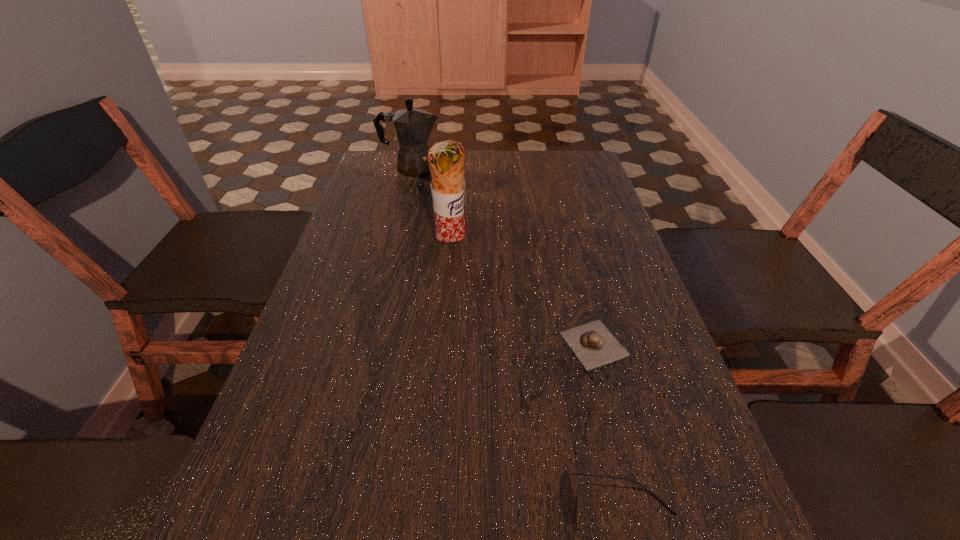
In order to click on burrito in this screenshot , I will do coord(446,159).

At what (x,y) coordinates should I click in order to perform the action: click on the tallest object. Please return your answer as a coordinate pair (x, y). This screenshot has height=540, width=960. Looking at the image, I should click on (446, 159).

This screenshot has height=540, width=960. In order to click on the farthest object in this screenshot , I will do `click(412, 127)`.

At what (x,y) coordinates should I click in order to perform the action: click on coffeepot. Please return your answer as a coordinate pair (x, y). Looking at the image, I should click on (412, 127).

The height and width of the screenshot is (540, 960). I want to click on the shortest object, so pos(592,343).

At what (x,y) coordinates should I click in order to perform the action: click on garlic. Please return your answer as a coordinate pair (x, y). This screenshot has width=960, height=540. Looking at the image, I should click on (592, 343).

Identify the location of vacant space situated 0.200m on the left of the burrito. This screenshot has height=540, width=960. (358, 246).

The width and height of the screenshot is (960, 540). I want to click on vacant space positioned on the pouring side of the third shortest object, so click(x=563, y=168).

Locate an element on the screen. Image resolution: width=960 pixels, height=540 pixels. vacant space located 0.200m on the front of the garlic is located at coordinates (627, 478).

At what (x,y) coordinates should I click in order to perform the action: click on object situated at the far edge. Please return your answer as a coordinate pair (x, y). Looking at the image, I should click on pyautogui.click(x=412, y=127).